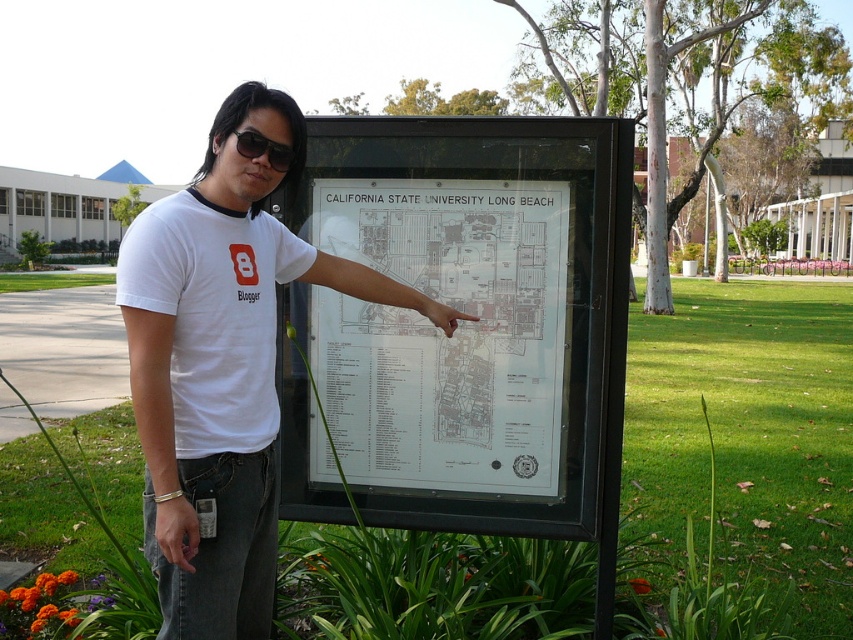
Question: Is white t-shirt at center behind white paper map at center?

Choices:
 (A) yes
 (B) no

Answer: (B)

Question: Which point appears farthest from the camera in this image?

Choices:
 (A) [430, 403]
 (B) [186, 193]
 (C) [271, 147]

Answer: (A)

Question: Among these points, which one is nearest to the camera?

Choices:
 (A) (234, 129)
 (B) (486, 429)
 (C) (190, 298)

Answer: (C)

Question: Which point is farther from the camera taking this photo?

Choices:
 (A) (x=262, y=92)
 (B) (x=250, y=145)

Answer: (A)

Question: Does white t-shirt at center have a lesser width compared to black plastic goggles at upper center?

Choices:
 (A) yes
 (B) no

Answer: (B)

Question: Can you confirm if white t-shirt at center is wider than white paper map at center?

Choices:
 (A) yes
 (B) no

Answer: (A)